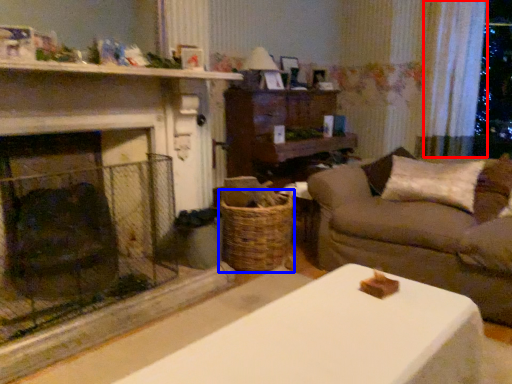
Question: Which of the following is the closest to the observer, curtain (highlighted by a red box) or basket (highlighted by a blue box)?

Choices:
 (A) curtain
 (B) basket

Answer: (B)